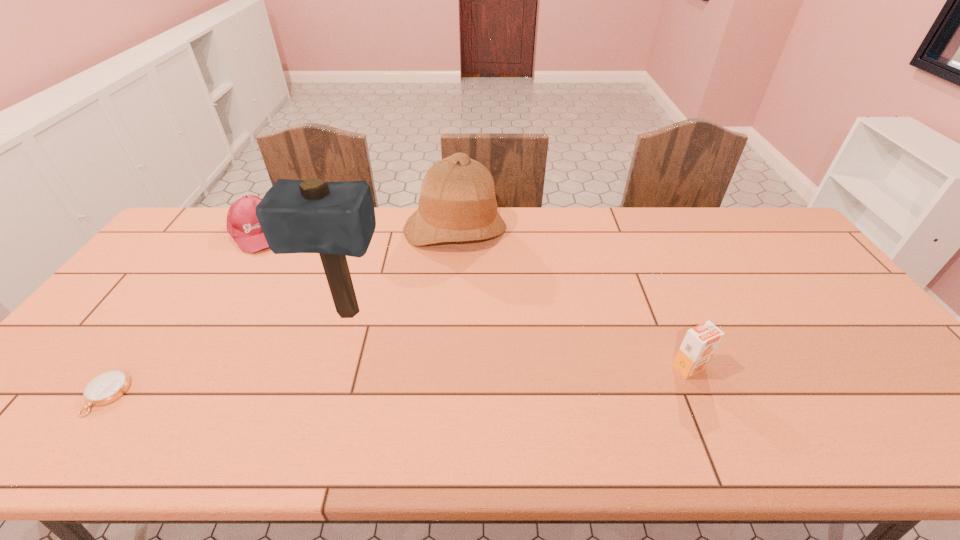
Where is `free space between the baseball cap and the compass`? The image size is (960, 540). free space between the baseball cap and the compass is located at coordinates (181, 314).

Locate an element on the screen. The width and height of the screenshot is (960, 540). blank region between the hat and the third farthest object is located at coordinates (401, 272).

What are the coordinates of `free point between the tallest object and the fourth shortest object` in the screenshot? It's located at (401, 272).

Identify the location of vacant space in between the fourth tallest object and the tallest object. (301, 273).

Where is `unoccupied position between the hat and the rightmost object`? This screenshot has width=960, height=540. unoccupied position between the hat and the rightmost object is located at coordinates (572, 299).

Locate an element on the screen. vacant space in between the orange juice and the hat is located at coordinates (572, 299).

The height and width of the screenshot is (540, 960). Identify the location of free spot between the compass and the baseball cap. (181, 314).

Find the location of a particular element. free area in between the fourth tallest object and the orange juice is located at coordinates (472, 300).

Where is `free space between the hat and the tallest object`? The width and height of the screenshot is (960, 540). free space between the hat and the tallest object is located at coordinates (401, 272).

Locate which object ranks fourth in proximity to the mallet. Please provide its 2D coordinates. Your answer should be formatted as a tuple, i.e. [(x, y)], where the tuple contains the x and y coordinates of a point satisfying the conditions above.

[(700, 342)]